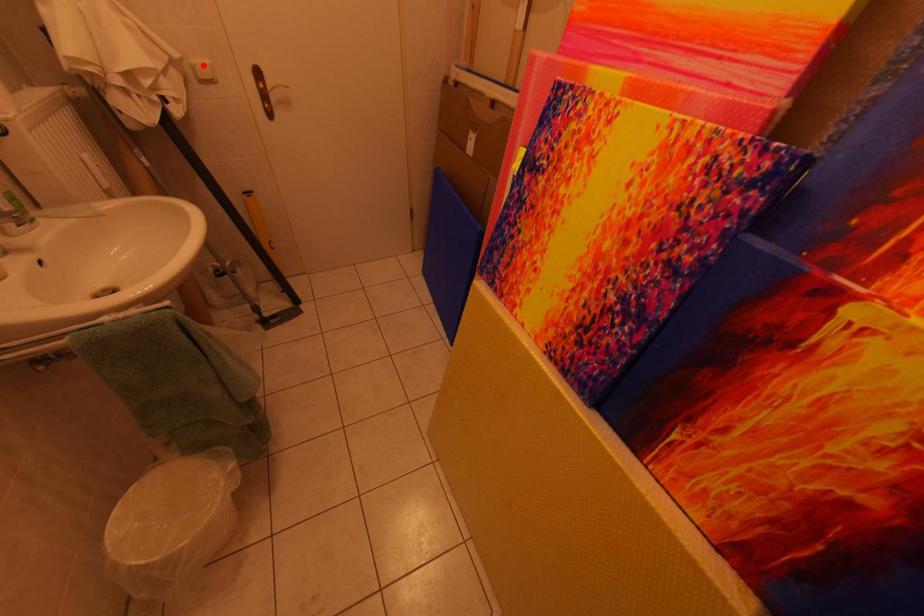
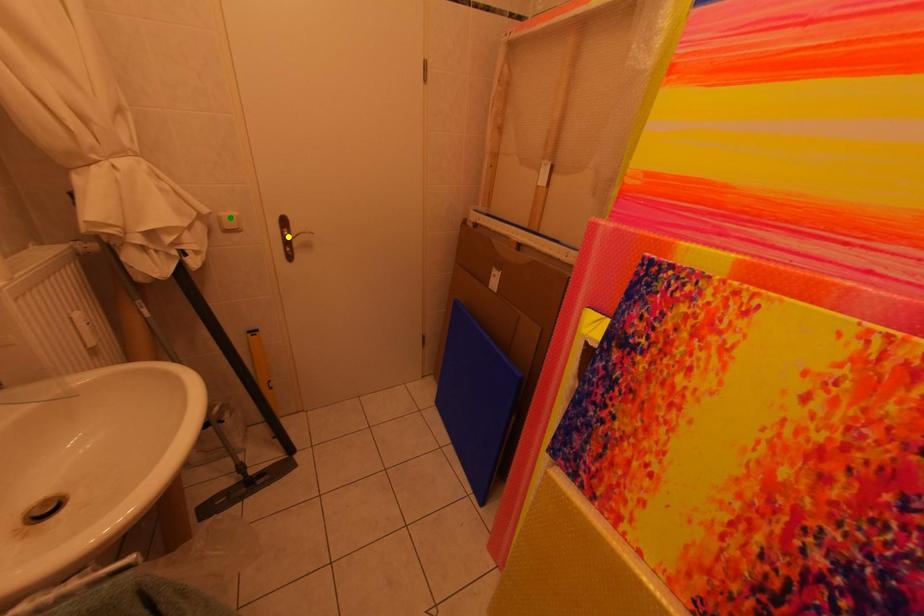
Question: I am providing you with two images of the same scene from different viewpoints. A red point is marked on the first image. You are given multiple points on the second image. Which spot in image 2 lines up with the point in image 1?

Choices:
 (A) blue point
 (B) green point
 (C) yellow point

Answer: (B)